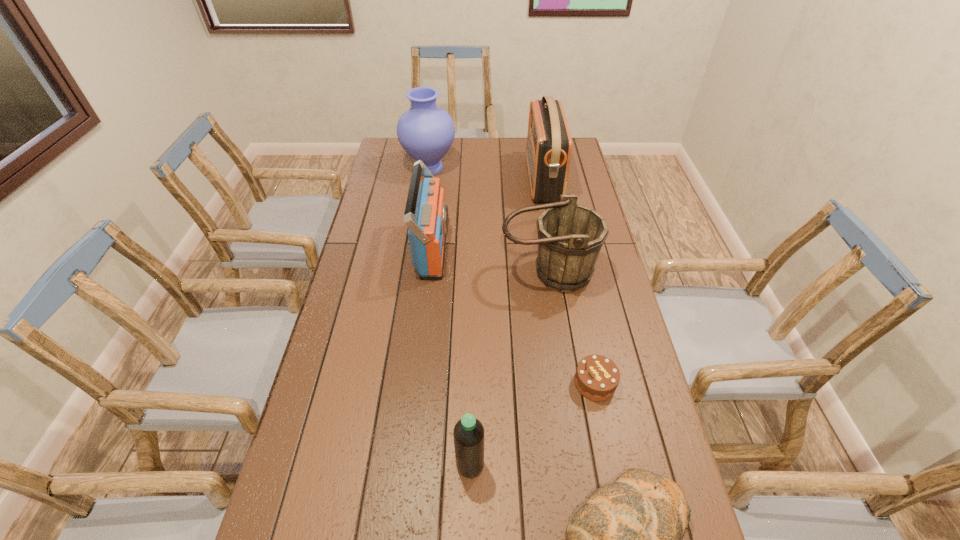
Locate an element on the screen. The width and height of the screenshot is (960, 540). vase is located at coordinates (426, 132).

Find the location of a particular element. the farther radio receiver is located at coordinates (548, 150).

The height and width of the screenshot is (540, 960). In order to click on the right radio receiver in this screenshot , I will do `click(548, 150)`.

The width and height of the screenshot is (960, 540). Identify the location of the left radio receiver. (426, 214).

Where is `the shorter radio receiver`? The image size is (960, 540). the shorter radio receiver is located at coordinates (426, 214).

Where is `bucket`? This screenshot has width=960, height=540. bucket is located at coordinates (570, 236).

In order to click on the fifth object from right to left in this screenshot , I will do `click(468, 433)`.

Identify the location of chocolate cake. Image resolution: width=960 pixels, height=540 pixels. (597, 377).

The image size is (960, 540). In order to click on the fifth farthest object in this screenshot , I will do `click(597, 377)`.

The image size is (960, 540). I want to click on vacant space located 0.150m on the back of the vase, so click(434, 138).